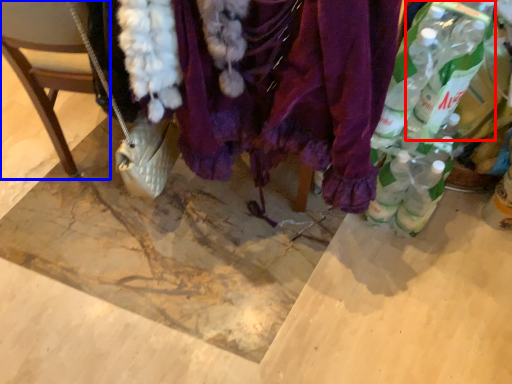
Question: Among these objects, which one is nearest to the camera, bottle (highlighted by a red box) or chair (highlighted by a blue box)?

Choices:
 (A) bottle
 (B) chair

Answer: (B)